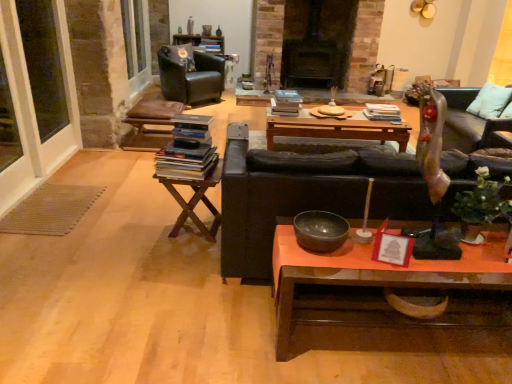
Locate an element on the screen. The width and height of the screenshot is (512, 384). vacant point above wooden polished coffee table at center, which is the 1th coffee table in top-to-bottom order (from a real-world perspective) is located at coordinates (341, 118).